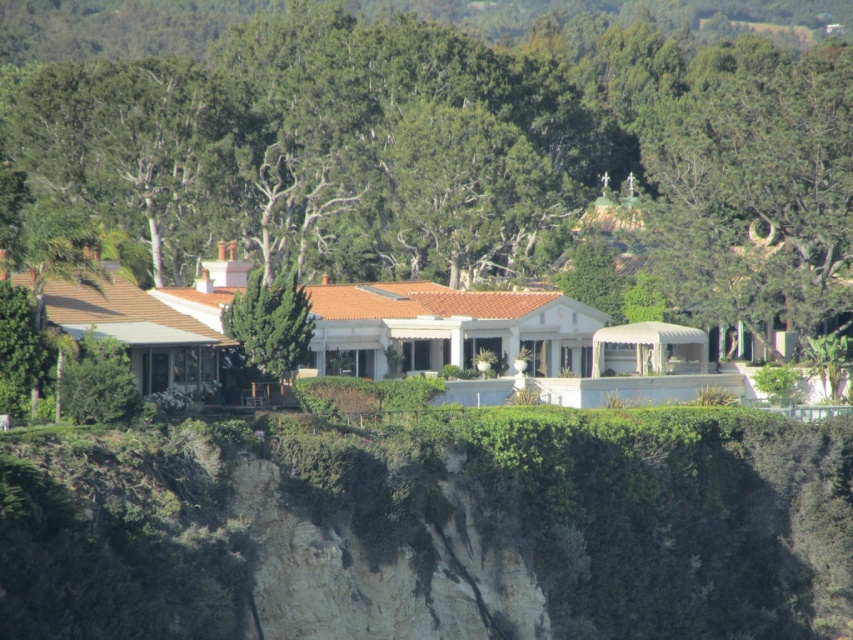
You are standing at the edge of the cliff near the house and want to place a small garden statue. The statue requires a flat area that is at least 0.5 meters wide. According to the coordinates provided, is the location at point (616, 513) suitable for placing the statue?

The point (616, 513) indicates a green mossy cliff at lower center, which is a rugged and rocky area. Since the statue requires a flat area of at least 0.5 meters wide, this location is not suitable due to the uneven terrain of the cliff.